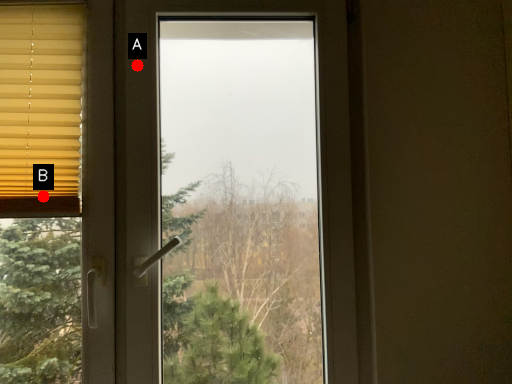
Question: Two points are circled on the image, labeled by A and B beside each circle. Which point is farther from the camera taking this photo?

Choices:
 (A) A is further
 (B) B is further

Answer: (A)